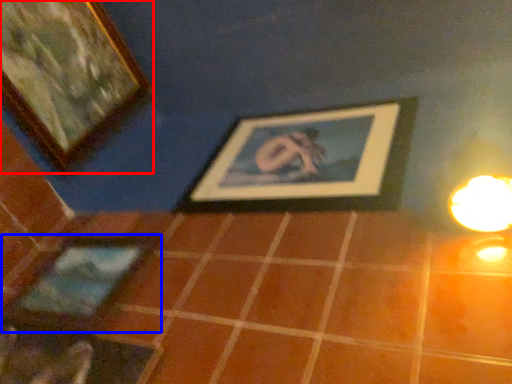
Question: Which point is closer to the camera, picture frame (highlighted by a red box) or picture frame (highlighted by a blue box)?

Choices:
 (A) picture frame
 (B) picture frame

Answer: (B)